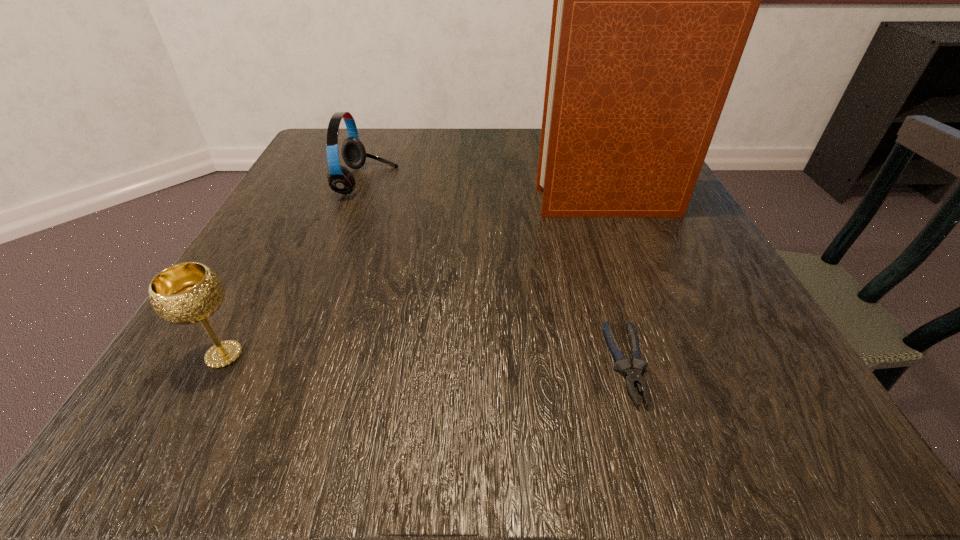
What are the coordinates of `chalice at the near edge` in the screenshot? It's located at (186, 293).

This screenshot has width=960, height=540. In order to click on pliers positioned at the near edge in this screenshot , I will do `click(633, 376)`.

This screenshot has width=960, height=540. Find the location of `headset situated at the left edge`. headset situated at the left edge is located at coordinates (341, 180).

In order to click on chalice that is positioned at the left edge in this screenshot , I will do `click(186, 293)`.

This screenshot has height=540, width=960. Find the location of `object that is at the right edge`. object that is at the right edge is located at coordinates (654, 0).

You are a GUI agent. You are given a task and a screenshot of the screen. Output one action in this format:
    pyautogui.click(x=<x>, y=<y>)
    Task: Click on the object positioned at the far left corner
    
    Given the screenshot: What is the action you would take?
    pyautogui.click(x=341, y=180)

Where is `object that is at the near left corner`? object that is at the near left corner is located at coordinates (186, 293).

Find the location of a particular element. The width and height of the screenshot is (960, 540). free point at the far edge is located at coordinates (444, 147).

You are a GUI agent. You are given a task and a screenshot of the screen. Output one action in this format:
    pyautogui.click(x=<x>, y=<y>)
    Task: Click on the vacant space at the near edge of the desktop
    Image resolution: width=960 pixels, height=540 pixels.
    Given the screenshot: What is the action you would take?
    pyautogui.click(x=441, y=403)

Find the location of `vacant space at the left edge of the desktop`. vacant space at the left edge of the desktop is located at coordinates (348, 238).